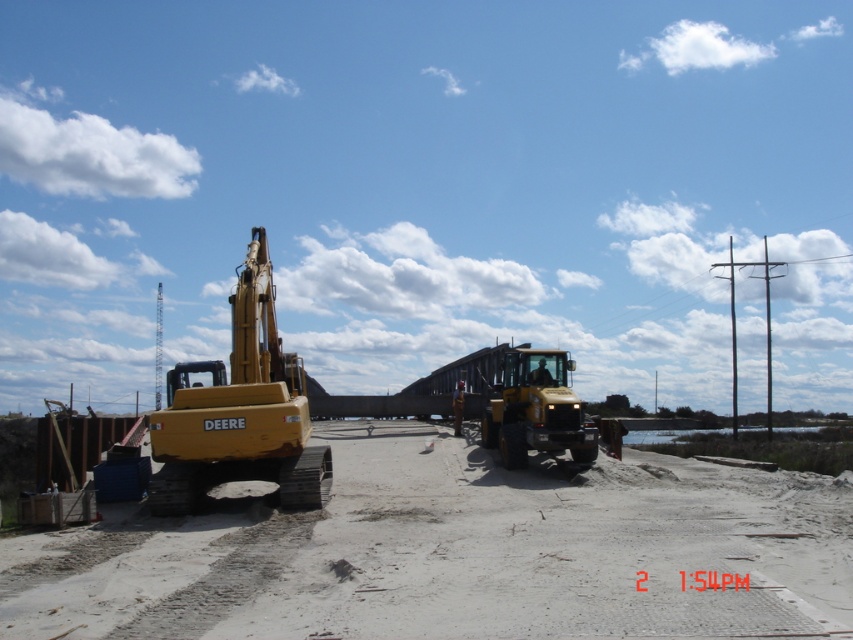
Question: Observing the image, what is the correct spatial positioning of dirt track at center in reference to yellow rubber tracked excavator at left?

Choices:
 (A) above
 (B) below

Answer: (B)

Question: Which of the following is the farthest from the observer?

Choices:
 (A) (613, 486)
 (B) (283, 461)
 (C) (514, 371)

Answer: (C)

Question: Does dirt track at center have a larger size compared to yellow rubber tracked excavator at left?

Choices:
 (A) no
 (B) yes

Answer: (B)

Question: Does dirt track at center come in front of yellow rubber tracked excavator at left?

Choices:
 (A) yes
 (B) no

Answer: (A)

Question: Estimate the real-world distances between objects in this image. Which object is closer to the yellow rubber tracked excavator at left?

Choices:
 (A) yellow metallic tractor at center
 (B) dirt track at center

Answer: (B)

Question: Based on their relative distances, which object is farther from the dirt track at center?

Choices:
 (A) yellow rubber tracked excavator at left
 (B) yellow metallic tractor at center

Answer: (A)